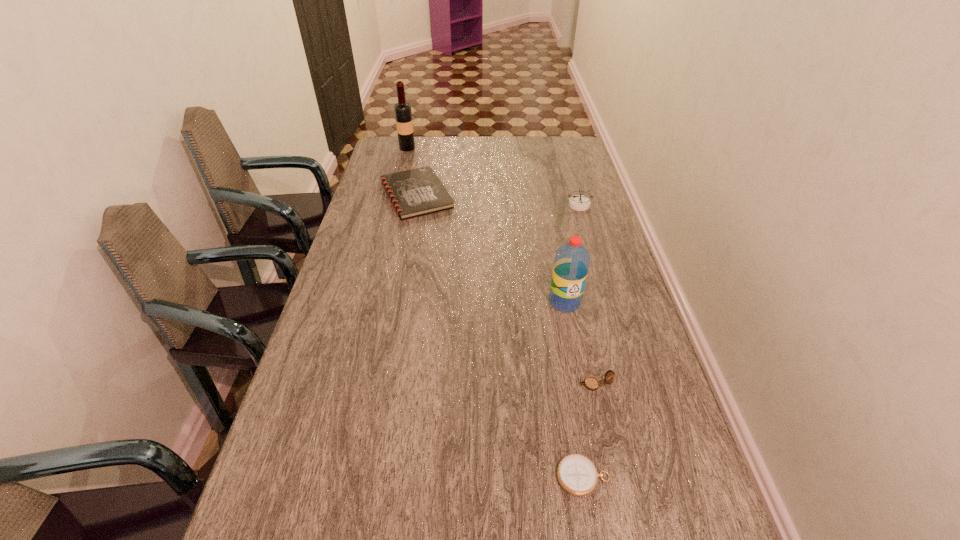
You are a GUI agent. You are given a task and a screenshot of the screen. Output one action in this format:
    pyautogui.click(x=<x>, y=<y>)
    Task: Click on the wine bottle present at the left edge
    
    Given the screenshot: What is the action you would take?
    pyautogui.click(x=403, y=114)

This screenshot has width=960, height=540. Find the location of `notebook at the left edge`. notebook at the left edge is located at coordinates (416, 192).

This screenshot has width=960, height=540. I want to click on water bottle situated at the right edge, so click(x=571, y=264).

At what (x,y) coordinates should I click in order to perform the action: click on object that is at the far left corner. Please return your answer as a coordinate pair (x, y). This screenshot has height=540, width=960. Looking at the image, I should click on (403, 114).

At what (x,y) coordinates should I click in order to perform the action: click on free space at the far edge of the desktop. Please return your answer as a coordinate pair (x, y). This screenshot has height=540, width=960. Looking at the image, I should click on (467, 147).

I want to click on blank space at the left edge, so click(366, 230).

Find the location of a particular element. The width and height of the screenshot is (960, 540). vacant space at the right edge of the desktop is located at coordinates (588, 316).

Locate an element on the screen. The image size is (960, 540). vacant space at the far right corner of the desktop is located at coordinates (546, 137).

Find the location of a particular element. This screenshot has width=960, height=540. free space that is in between the fourth farthest object and the fifth tallest object is located at coordinates (491, 248).

I want to click on vacant area that lies between the farthest compass and the tallest object, so click(493, 176).